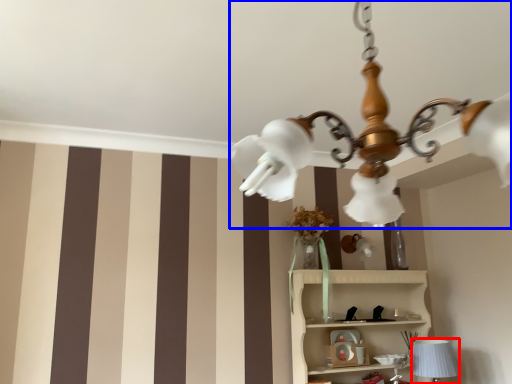
Question: Which point is further to the camera, table lamp (highlighted by a red box) or lamp (highlighted by a blue box)?

Choices:
 (A) table lamp
 (B) lamp

Answer: (A)